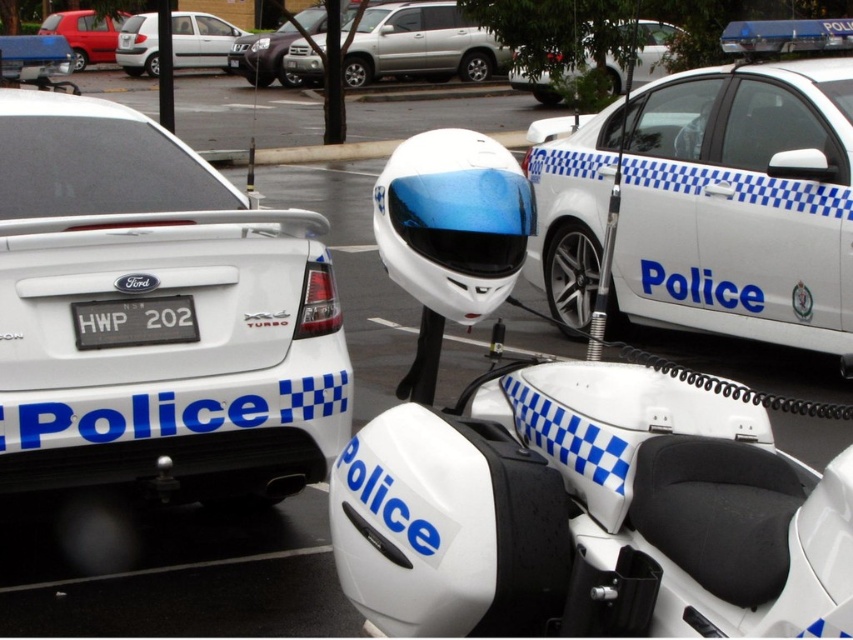
Question: Considering the real-world distances, which object is farthest from the matte silver suv at upper center?

Choices:
 (A) white glossy police car at left
 (B) black plastic license plate at rear
 (C) matte red sedan at upper left
 (D) white glossy helmet at upper center

Answer: (D)

Question: Does white glossy helmet at upper center come behind matte red sedan at upper left?

Choices:
 (A) no
 (B) yes

Answer: (A)

Question: Estimate the real-world distances between objects in this image. Which object is farther from the white glossy police car at center?

Choices:
 (A) silver metallic hatchback at upper left
 (B) matte silver suv at upper center
 (C) white glossy helmet at upper center

Answer: (A)

Question: Which point is farther to the camera?

Choices:
 (A) (293, 76)
 (B) (688, 540)
 (C) (212, 241)
 (D) (103, 51)

Answer: (D)

Question: Can you confirm if white glossy police car at upper center is positioned to the right of matte red sedan at upper left?

Choices:
 (A) no
 (B) yes

Answer: (B)

Question: Is white glossy police car at left smaller than silver metallic hatchback at upper left?

Choices:
 (A) no
 (B) yes

Answer: (A)